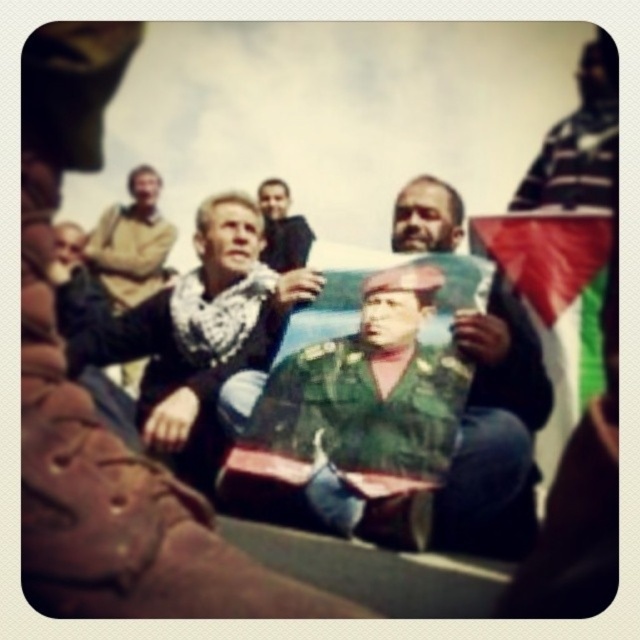
You are a photographer trying to capture a clear shot of the dark green uniform at center from the position of the light brown leather jacket at upper left. Given that your camera has a maximum focus range of 7 meters, will you be able to take a clear photo?

The light brown leather jacket at upper left is 7.11 meters from the dark green uniform at center. Since the distance exceeds the camera maximum focus range of 7 meters, you won the able to take a clear photo.